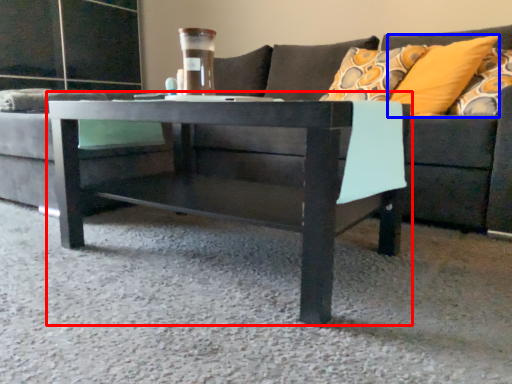
Question: Which object is closer to the camera taking this photo, coffee table (highlighted by a red box) or pillow (highlighted by a blue box)?

Choices:
 (A) coffee table
 (B) pillow

Answer: (A)